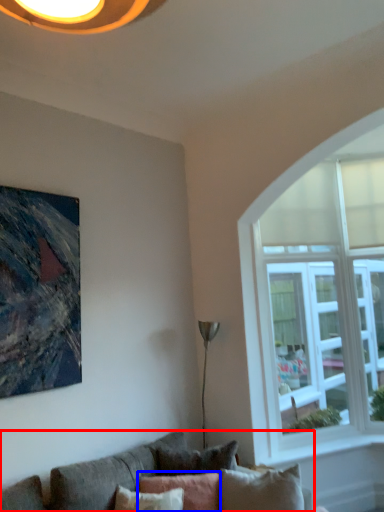
Question: Which object is further to the camera taking this photo, studio couch (highlighted by a red box) or pillow (highlighted by a blue box)?

Choices:
 (A) studio couch
 (B) pillow

Answer: (B)